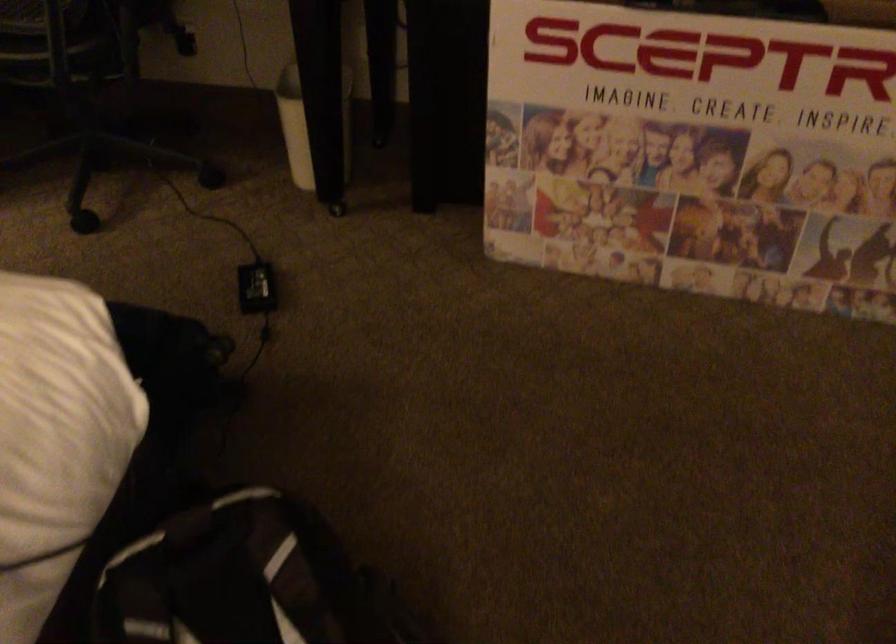
The location [692,149] corresponds to which object?

It corresponds to the Sceptre cardboard box in the image.